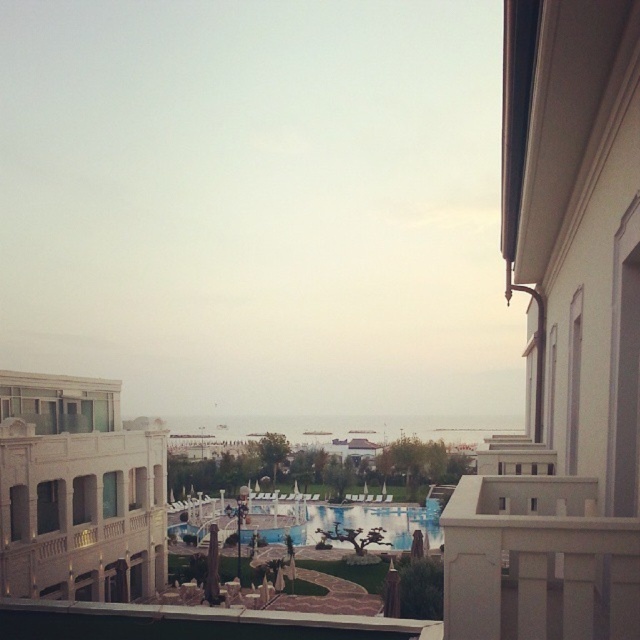
You are standing on a balcony overlooking a resort area. You notice two buildings in the scene. Which building, the white smooth building at right or the white stone building at left, is larger in size?

The white smooth building at right is bigger than the white stone building at left.

You are standing on the balcony looking out. Which object is closer to you, the white stone building at left or the white concrete balustrade at upper right?

The white concrete balustrade at upper right is closer to you because it is positioned above the white stone building at left, which is located further away.

You are standing on the balcony looking out. Where is the white smooth building at right located in the image?

The white smooth building at right is located at the coordinates point [563,342] in the image.